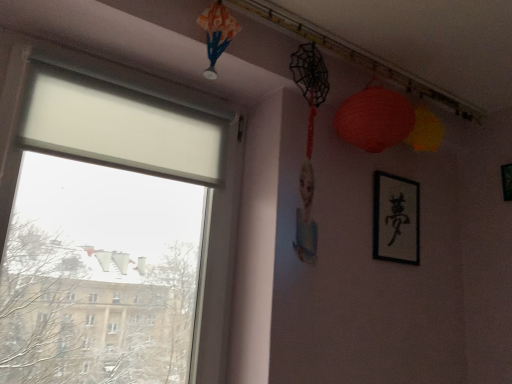
Question: Considering the relative positions of matte paper lantern at upper right and black matte picture frame at upper right, the 1th picture frame when ordered from right to left, in the image provided, is matte paper lantern at upper right behind black matte picture frame at upper right, the 1th picture frame when ordered from right to left,?

Choices:
 (A) no
 (B) yes

Answer: (A)

Question: From a real-world perspective, is matte paper lantern at upper right physically above black matte picture frame at upper right, the 1th picture frame when ordered from right to left?

Choices:
 (A) no
 (B) yes

Answer: (B)

Question: From a real-world perspective, is matte paper lantern at upper right beneath black matte picture frame at upper right, the 2th picture frame in the left-to-right sequence?

Choices:
 (A) yes
 (B) no

Answer: (B)

Question: Can you confirm if matte paper lantern at upper right is wider than black matte picture frame at upper right, the 2th picture frame in the left-to-right sequence?

Choices:
 (A) no
 (B) yes

Answer: (B)

Question: Does matte paper lantern at upper right have a lesser height compared to black matte picture frame at upper right, the 2th picture frame in the left-to-right sequence?

Choices:
 (A) yes
 (B) no

Answer: (B)

Question: Is matte paper lantern at upper right outside of black matte picture frame at upper right, the 2th picture frame in the left-to-right sequence?

Choices:
 (A) yes
 (B) no

Answer: (A)

Question: Is black paper at upper right, which is counted as the second picture frame, starting from the right, thinner than matte paper lantern at upper right?

Choices:
 (A) no
 (B) yes

Answer: (B)

Question: Is black paper at upper right, the first picture frame when ordered from left to right, taller than matte paper lantern at upper right?

Choices:
 (A) no
 (B) yes

Answer: (B)

Question: Is black paper at upper right, which is counted as the second picture frame, starting from the right, positioned behind matte paper lantern at upper right?

Choices:
 (A) no
 (B) yes

Answer: (B)

Question: Is matte paper lantern at upper right surrounded by black paper at upper right, which is counted as the second picture frame, starting from the right?

Choices:
 (A) no
 (B) yes

Answer: (A)

Question: Are black paper at upper right, the first picture frame when ordered from left to right, and matte paper lantern at upper right located far from each other?

Choices:
 (A) no
 (B) yes

Answer: (A)

Question: Is black paper at upper right, which is counted as the second picture frame, starting from the right, oriented away from matte paper lantern at upper right?

Choices:
 (A) no
 (B) yes

Answer: (A)

Question: Is black matte picture frame at upper right, the 2th picture frame in the left-to-right sequence, touching black paper at upper right, the first picture frame when ordered from left to right?

Choices:
 (A) yes
 (B) no

Answer: (B)